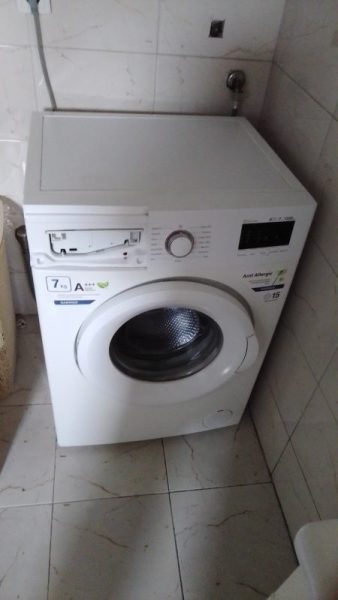
The image size is (338, 600). In order to click on wall,  floor  grout in this screenshot , I will do `click(112, 28)`, `click(95, 558)`, `click(306, 90)`.